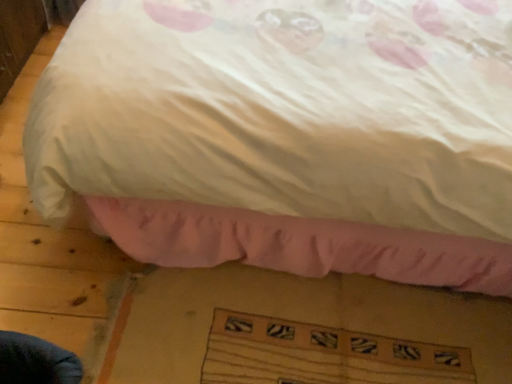
Locate an element on the screen. white satin bed at center is located at coordinates (287, 135).

What is the approximate width of white satin bed at center?

white satin bed at center is 7.25 feet in width.

Describe the element at coordinates (287, 135) in the screenshot. The image size is (512, 384). I see `white satin bed at center` at that location.

Where is `white satin bed at center`? white satin bed at center is located at coordinates (287, 135).